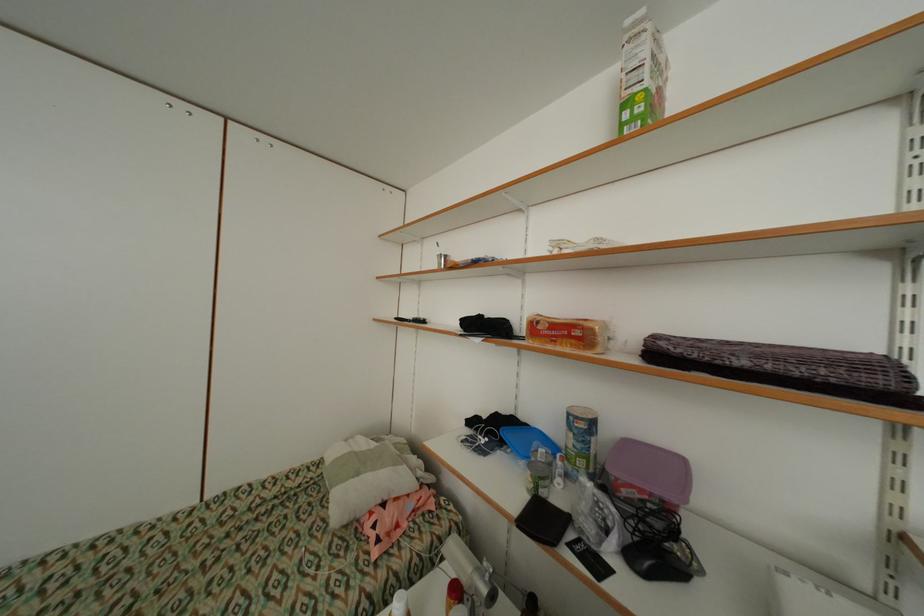
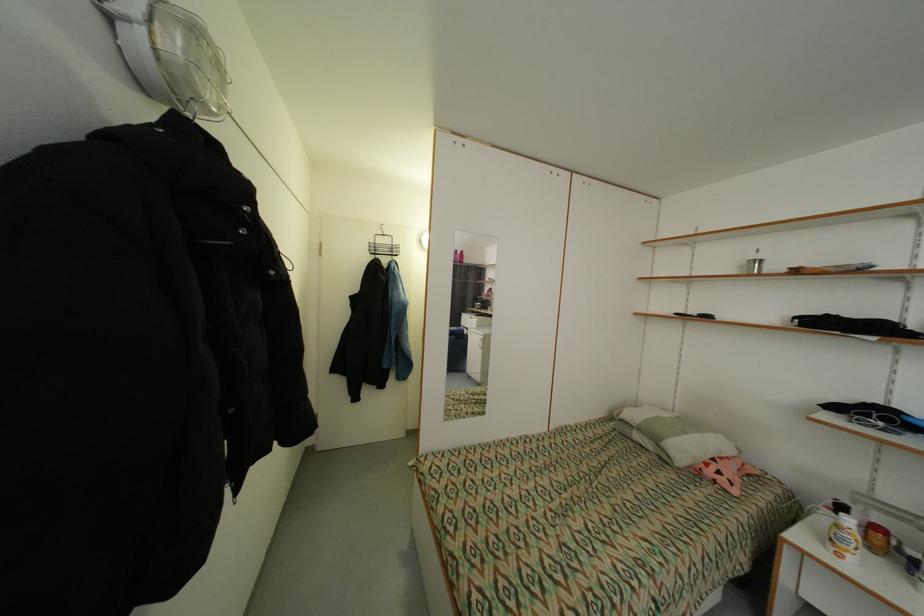
In a continuous first-person perspective shot, in which direction is the camera moving?

The cameraman moved toward left, backward.